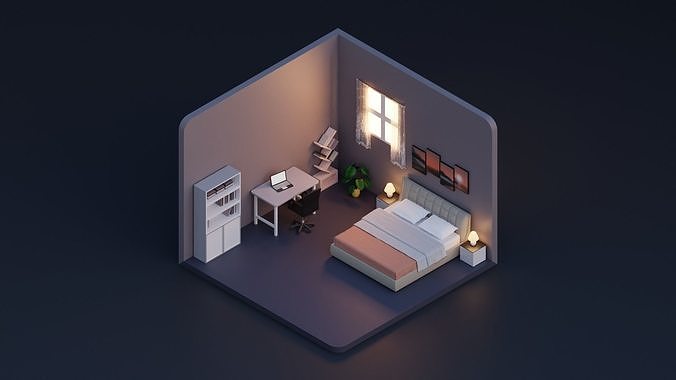
At what (x,y) coordinates should I click in order to perform the action: click on pillow. Please return your answer as a coordinate pair (x, y). Looking at the image, I should click on (410, 214).